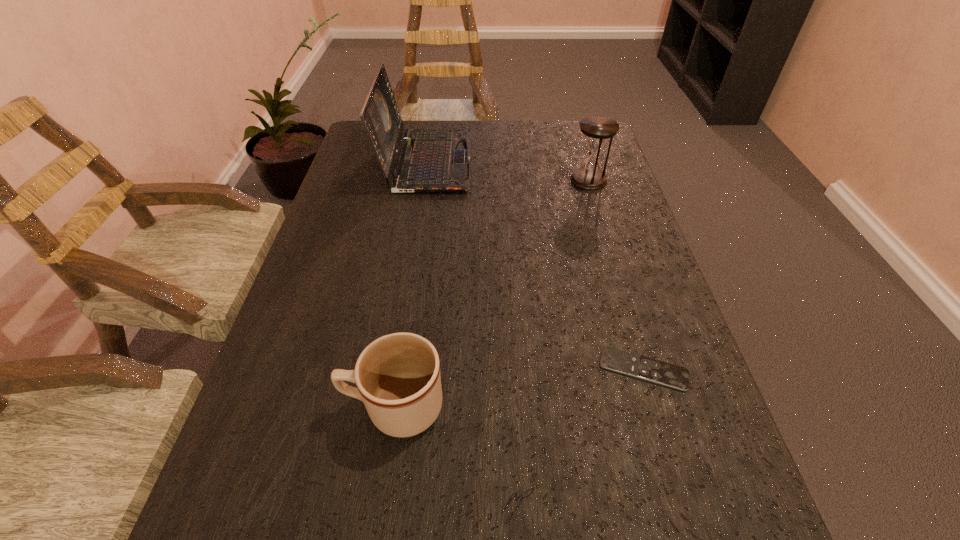
Find the location of a particular element. The image size is (960, 540). free space between the third shortest object and the shortest object is located at coordinates (616, 275).

Where is `vacant area that lies between the laptop computer and the second tallest object`? vacant area that lies between the laptop computer and the second tallest object is located at coordinates (508, 171).

Identify the location of free space between the tallest object and the mug. (411, 284).

The width and height of the screenshot is (960, 540). Identify the location of vacant space that is in between the second tallest object and the shortest object. (616, 275).

This screenshot has width=960, height=540. I want to click on free space between the laptop computer and the hourglass, so coord(508,171).

Locate an element on the screen. Image resolution: width=960 pixels, height=540 pixels. free point between the hourglass and the remote control is located at coordinates (616, 275).

Where is `vacant point located between the shortest object and the hourglass`? The height and width of the screenshot is (540, 960). vacant point located between the shortest object and the hourglass is located at coordinates (616, 275).

Where is `free space that is in between the second shortest object and the hourglass`? This screenshot has height=540, width=960. free space that is in between the second shortest object and the hourglass is located at coordinates (492, 293).

Locate which object is the closest to the third tallest object. Please provide its 2D coordinates. Your answer should be formatted as a tuple, i.e. [(x, y)], where the tuple contains the x and y coordinates of a point satisfying the conditions above.

[(659, 372)]

Where is `object that is the third closest to the shortest object`? The width and height of the screenshot is (960, 540). object that is the third closest to the shortest object is located at coordinates (431, 160).